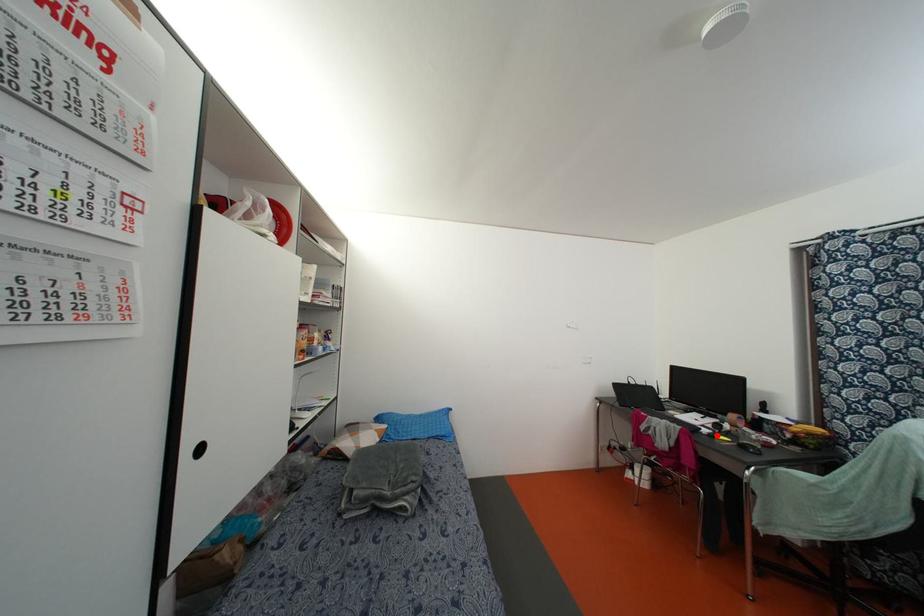
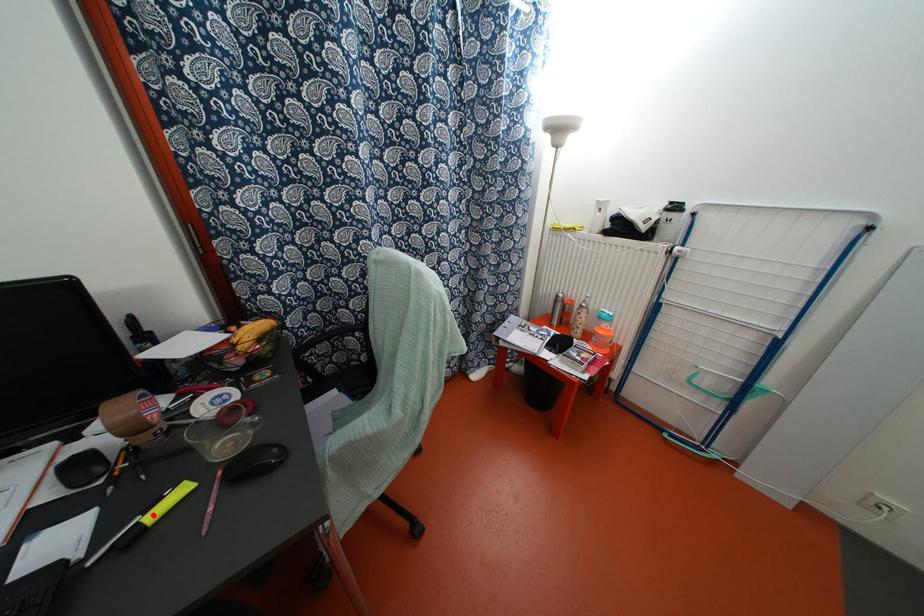
I am providing you with two images of the same scene from different viewpoints. A red point is marked on the first image and another point is marked on the second image. Does the point marked in image1 correspond to the same location as the one in image2?

Yes